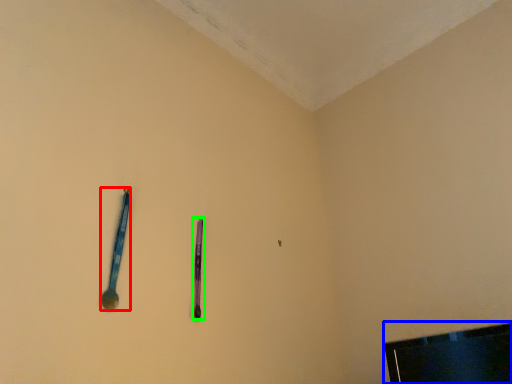
Question: Which object is the farthest from spoon (highlighted by a red box)? Choose among these: television (highlighted by a blue box) or writing (highlighted by a green box).

Choices:
 (A) television
 (B) writing

Answer: (A)